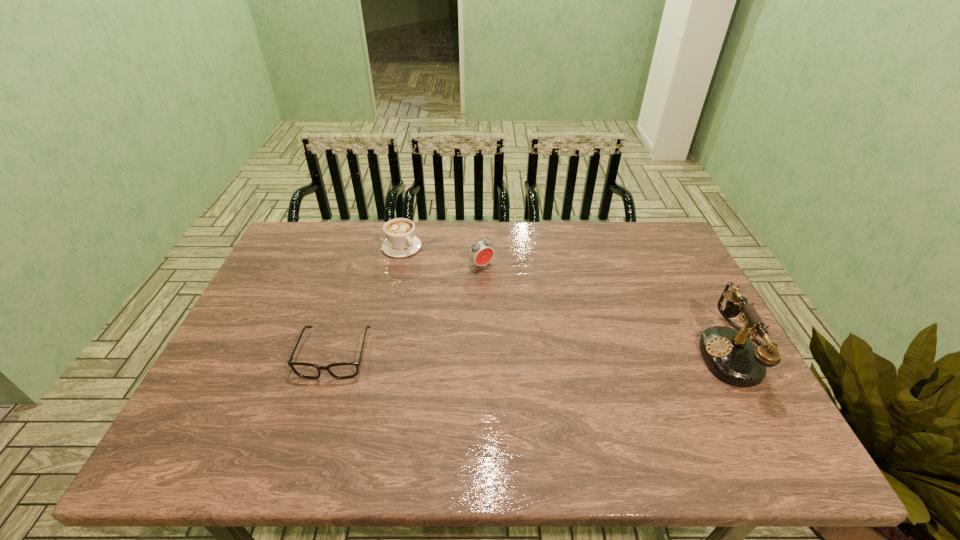
Locate an element on the screen. The height and width of the screenshot is (540, 960). the shortest object is located at coordinates (344, 370).

I want to click on the tallest object, so click(730, 354).

Where is `the rightmost object`? the rightmost object is located at coordinates (730, 354).

Locate an element on the screen. This screenshot has width=960, height=540. the second object from right to left is located at coordinates (480, 253).

Locate an element on the screen. The height and width of the screenshot is (540, 960). alarm clock is located at coordinates (480, 253).

The width and height of the screenshot is (960, 540). What are the coordinates of `the second shortest object` in the screenshot? It's located at (401, 242).

The height and width of the screenshot is (540, 960). I want to click on cappuccino, so click(401, 242).

I want to click on free spot located on the dial of the tallest object, so click(546, 354).

This screenshot has width=960, height=540. I want to click on vacant space located on the dial of the tallest object, so click(554, 354).

This screenshot has height=540, width=960. Find the location of `free space located on the dial of the tallest object`. free space located on the dial of the tallest object is located at coordinates (586, 354).